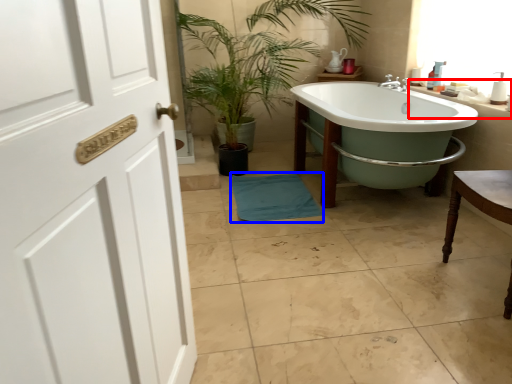
Question: Which point is closer to the camera, counter top (highlighted by a red box) or bath towel (highlighted by a blue box)?

Choices:
 (A) counter top
 (B) bath towel

Answer: (A)